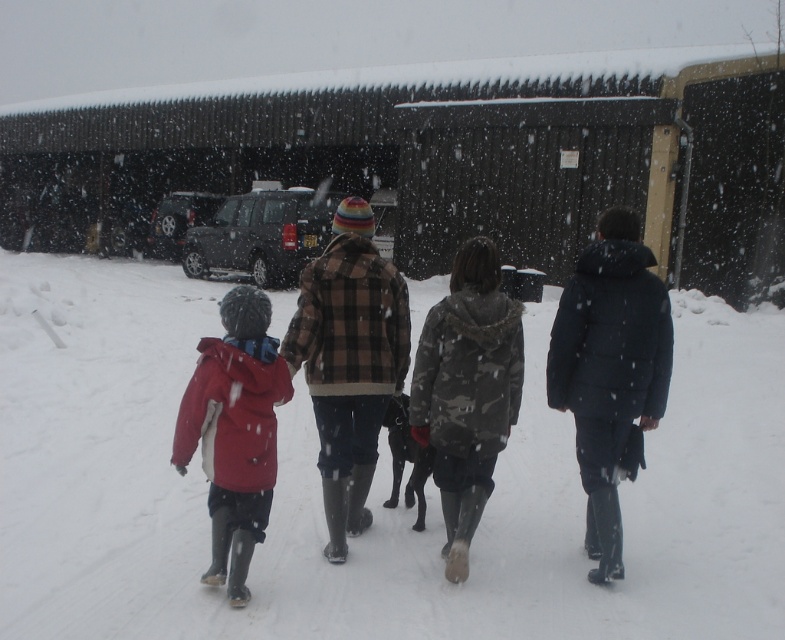
You are a photographer trying to capture a group photo of the red plaid jacket at center and the matte red jacket at left. If you want to ensure both jackets are in focus, which one should you focus on first considering their sizes?

The red plaid jacket at center has a larger size compared to matte red jacket at left, so you should focus on the red plaid jacket at center first to ensure both are in focus.

You are a photographer trying to capture a photo of the group in the snow. You need to ensure that both the red plaid jacket at center and the matte red jacket at left are clearly visible in the frame. Based on their sizes, which jacket will appear larger in the photo?

The red plaid jacket at center will appear larger in the photo because it is taller than the matte red jacket at left.